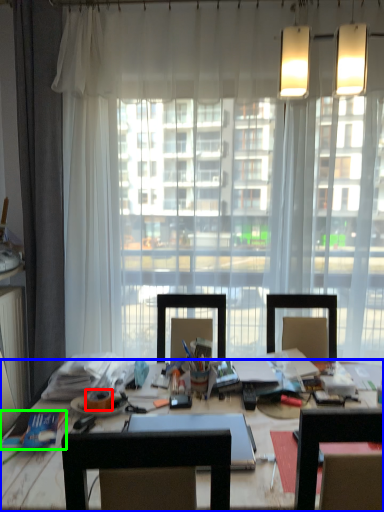
Question: Considering the real-world distances, which object is closest to adhesive tape (highlighted by a red box)? desk (highlighted by a blue box) or book (highlighted by a green box).

Choices:
 (A) desk
 (B) book

Answer: (B)